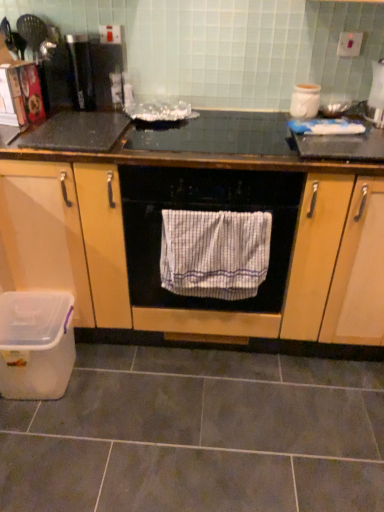
Question: Considering the positions of white glossy kettle at upper right, which appears as the 2th appliance when viewed from the left, and white glossy jar at upper right, which appears as the 2th appliance when viewed from the right, in the image, is white glossy kettle at upper right, which appears as the 2th appliance when viewed from the left, bigger or smaller than white glossy jar at upper right, which appears as the 2th appliance when viewed from the right,?

Choices:
 (A) big
 (B) small

Answer: (A)

Question: Visually, is white glossy kettle at upper right, which appears as the first appliance when viewed from the right, positioned to the left or to the right of white glossy jar at upper right, which appears as the 2th appliance when viewed from the right?

Choices:
 (A) right
 (B) left

Answer: (A)

Question: Which object is the farthest from the transparent plastic container at lower left?

Choices:
 (A) white striped towel at center
 (B) white glossy jar at upper right, which is counted as the first appliance, starting from the left
 (C) white glossy kettle at upper right, which appears as the first appliance when viewed from the right
 (D) white striped towel at center
 (E) wooden cabinet at center

Answer: (C)

Question: Which object is the closest to the white glossy kettle at upper right, which appears as the first appliance when viewed from the right?

Choices:
 (A) transparent plastic container at lower left
 (B) white striped towel at center
 (C) white glossy jar at upper right, which is counted as the first appliance, starting from the left
 (D) wooden cabinet at center
 (E) white striped towel at center

Answer: (C)